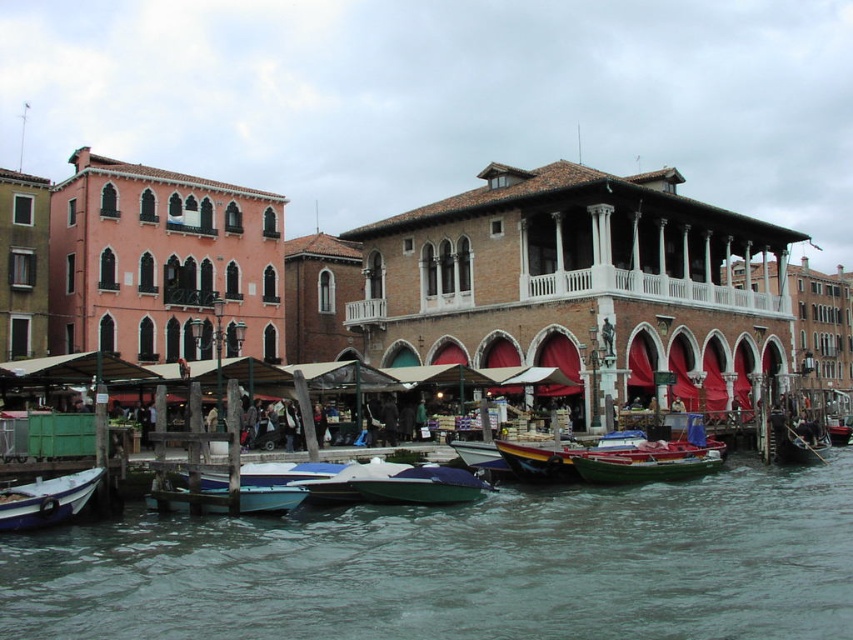
Does green water at lower center lie behind shiny blue boat at center?

No.

Does green water at lower center have a larger size compared to shiny blue boat at center?

Yes.

Between point (294, 628) and point (413, 500), which one is positioned behind?

Positioned behind is point (413, 500).

I want to click on green water at lower center, so click(x=463, y=566).

Is green water at lower center smaller than white wooden boat at lower left?

No, green water at lower center is not smaller than white wooden boat at lower left.

Find the location of a particular element. green water at lower center is located at coordinates (463, 566).

The image size is (853, 640). What do you see at coordinates (463, 566) in the screenshot?
I see `green water at lower center` at bounding box center [463, 566].

Where is `green water at lower center`? This screenshot has width=853, height=640. green water at lower center is located at coordinates (463, 566).

Does point (329, 580) come closer to viewer compared to point (624, 460)?

Yes, it is in front of point (624, 460).

The image size is (853, 640). What do you see at coordinates (463, 566) in the screenshot?
I see `green water at lower center` at bounding box center [463, 566].

Locate an element on the screen. The image size is (853, 640). green water at lower center is located at coordinates (x=463, y=566).